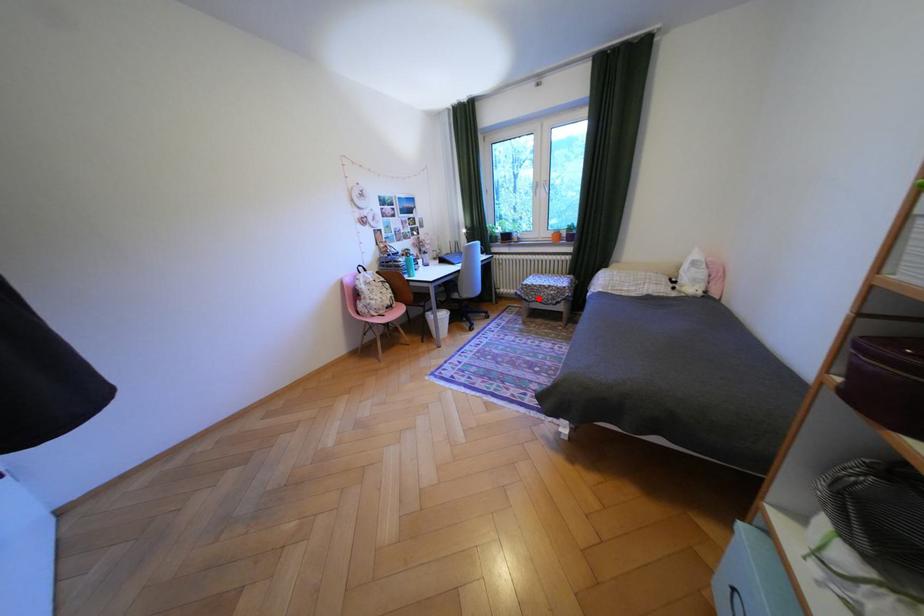
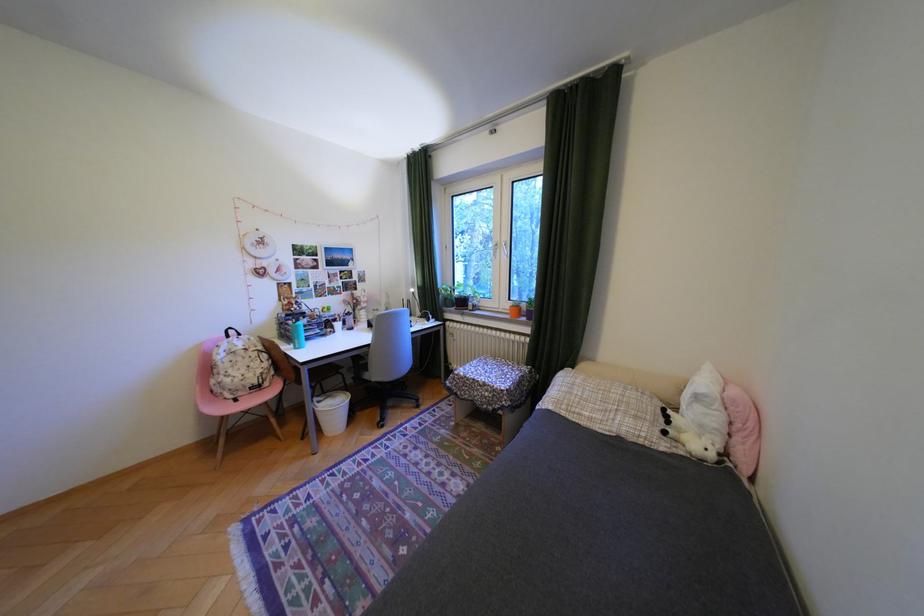
Question: I am providing you with two images of the same scene from different viewpoints. Given a red point in image1, look at the same physical point in image2. Is it:

Choices:
 (A) Closer to the viewpoint
 (B) Farther from the viewpoint

Answer: (B)